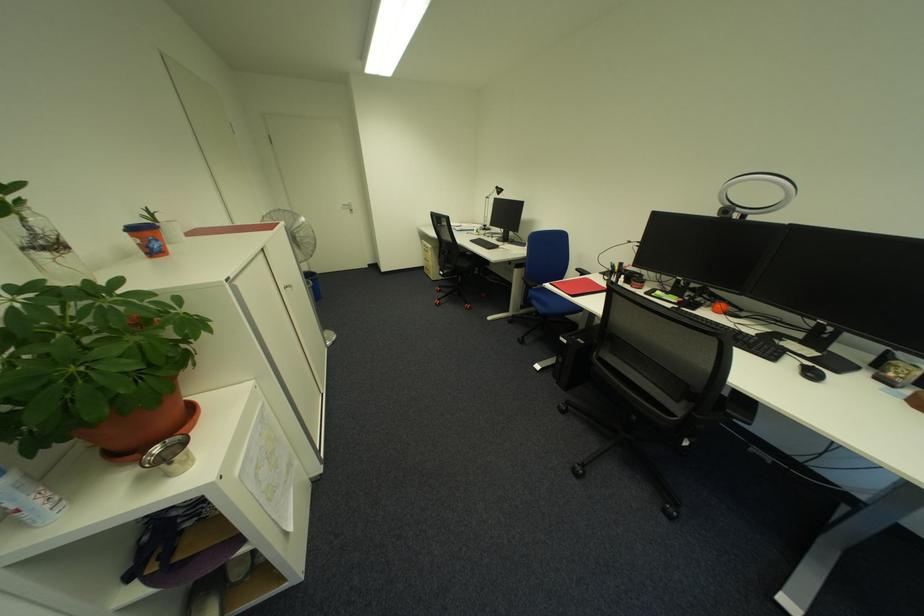
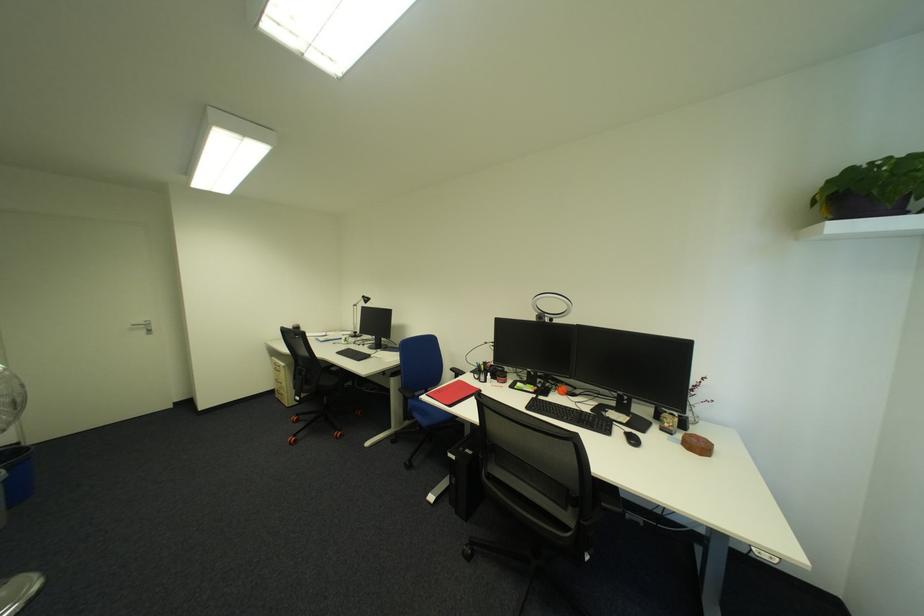
In the second image, find the point that corresponds to the point at 801,363 in the first image.

(628, 432)